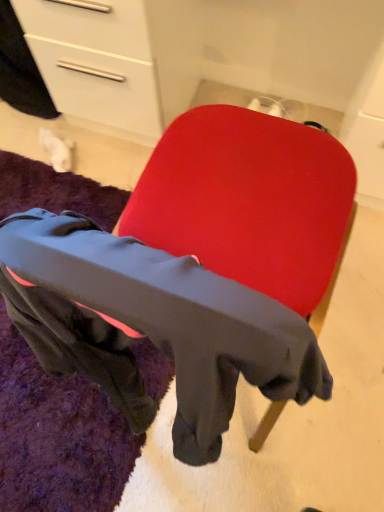
Question: Is black fleece mat at lower left outside matte red chair at center?

Choices:
 (A) yes
 (B) no

Answer: (A)

Question: Does black fleece mat at lower left have a larger size compared to matte red chair at center?

Choices:
 (A) yes
 (B) no

Answer: (B)

Question: Is black fleece mat at lower left not close to matte red chair at center?

Choices:
 (A) no
 (B) yes

Answer: (A)

Question: Would you say matte red chair at center is part of black fleece mat at lower left's contents?

Choices:
 (A) yes
 (B) no

Answer: (B)

Question: From a real-world perspective, is black fleece mat at lower left positioned under matte red chair at center based on gravity?

Choices:
 (A) no
 (B) yes

Answer: (B)

Question: From a real-world perspective, is black fleece mat at lower left on matte red chair at center?

Choices:
 (A) no
 (B) yes

Answer: (A)

Question: Considering the relative positions of matte red chair at center and black fleece mat at lower left in the image provided, is matte red chair at center to the left of black fleece mat at lower left from the viewer's perspective?

Choices:
 (A) no
 (B) yes

Answer: (A)

Question: Is the depth of matte red chair at center greater than that of black fleece mat at lower left?

Choices:
 (A) yes
 (B) no

Answer: (B)

Question: Considering the relative sizes of matte red chair at center and black fleece mat at lower left in the image provided, is matte red chair at center wider than black fleece mat at lower left?

Choices:
 (A) yes
 (B) no

Answer: (B)

Question: From the image's perspective, is matte red chair at center above black fleece mat at lower left?

Choices:
 (A) yes
 (B) no

Answer: (A)

Question: Is matte red chair at center closer to the viewer compared to black fleece mat at lower left?

Choices:
 (A) yes
 (B) no

Answer: (A)

Question: From the image's perspective, is matte red chair at center located beneath black fleece mat at lower left?

Choices:
 (A) no
 (B) yes

Answer: (A)

Question: Would you say black fleece mat at lower left is inside or outside matte red chair at center?

Choices:
 (A) outside
 (B) inside

Answer: (A)